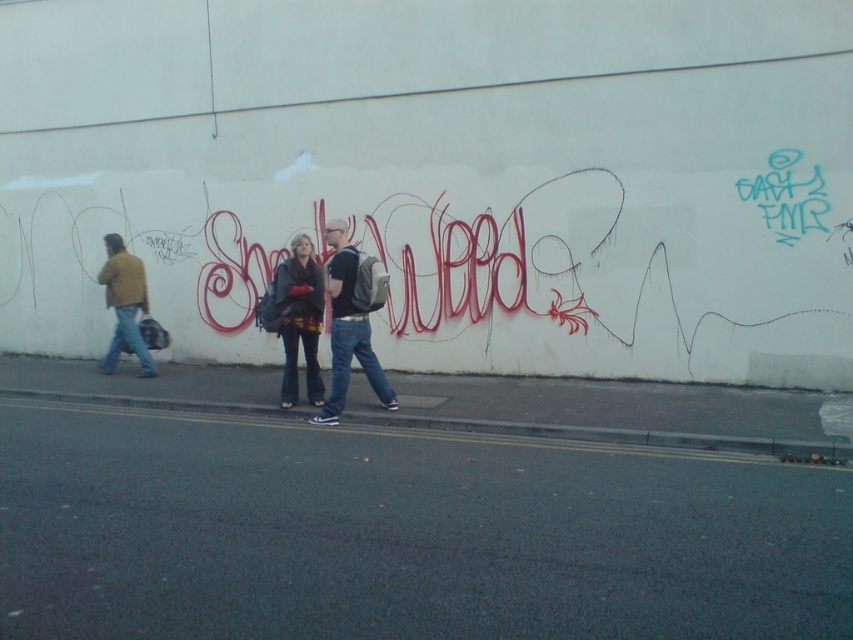
You are a delivery person who needs to place a small package between the matte black backpack at center and the matte yellow jacket at left. Can you fit it there?

The matte black backpack at center is larger than the matte yellow jacket at left, so there might be enough space between them to fit a small package.

From the picture: You are a photographer trying to capture a candid shot of the two people at the center of the graffiti wall. Your camera has a lens that can focus on objects within a 24 inch range. Can you fit both the matte black backpack at center and the matte black jacket at center in the same frame without moving the camera?

The matte black backpack at center and the matte black jacket at center are 26.05 inches apart, which exceeds the camera lens 24 inch range. Therefore, you cannot fit both in the same frame without moving the camera.

You are standing in the urban street scene looking at the graffiti on the white wall. There are two points marked on the wall at coordinates point (337, 412) and point (123, 330). Which point is closer to you?

Point (337, 412) is closer to the viewer than point (123, 330).